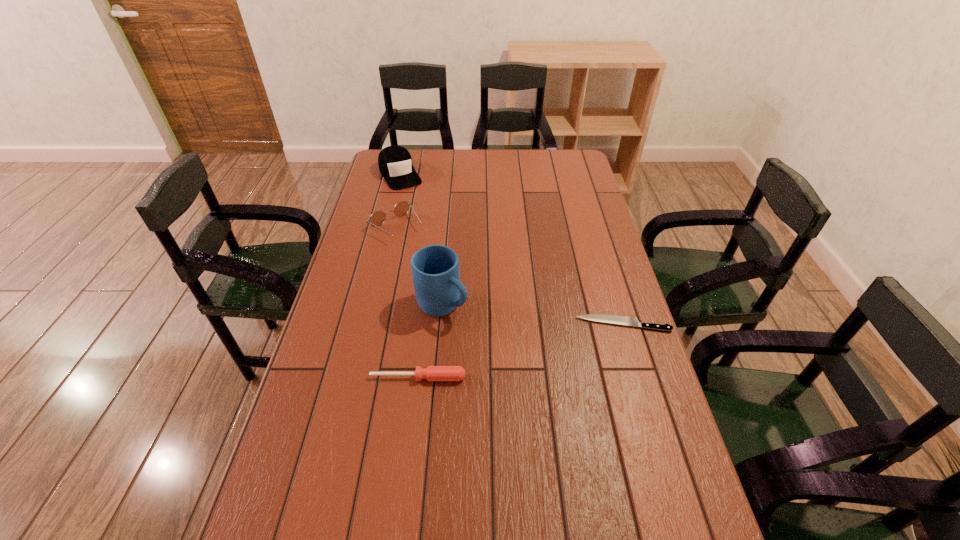
Where is `object at the far edge`? This screenshot has width=960, height=540. object at the far edge is located at coordinates (395, 164).

The height and width of the screenshot is (540, 960). What are the coordinates of `cap situated at the left edge` in the screenshot? It's located at (395, 164).

Identify the location of spectacles that is at the left edge. The height and width of the screenshot is (540, 960). (401, 208).

This screenshot has height=540, width=960. I want to click on object at the right edge, so click(x=612, y=319).

Locate an element on the screen. object that is at the far left corner is located at coordinates (395, 164).

I want to click on vacant space at the far edge of the desktop, so click(x=493, y=173).

Image resolution: width=960 pixels, height=540 pixels. In the image, there is a desktop. In order to click on free space at the near edge in this screenshot , I will do click(x=474, y=516).

Identify the location of free location at the left edge of the desktop. Image resolution: width=960 pixels, height=540 pixels. (335, 344).

In the image, there is a desktop. Identify the location of blank space at the right edge. The width and height of the screenshot is (960, 540). (581, 216).

In the image, there is a desktop. Where is `blank space at the far right corner`? The image size is (960, 540). blank space at the far right corner is located at coordinates (573, 158).